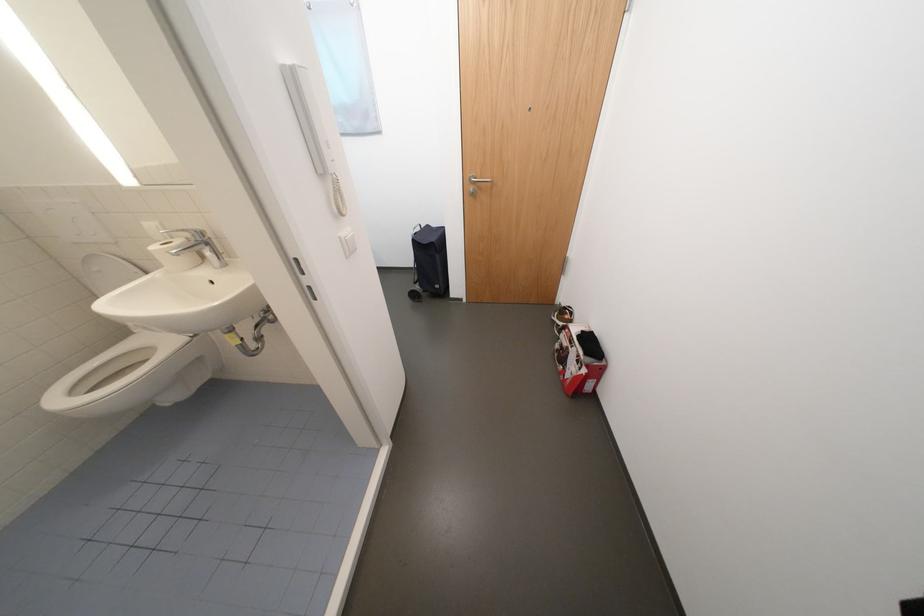
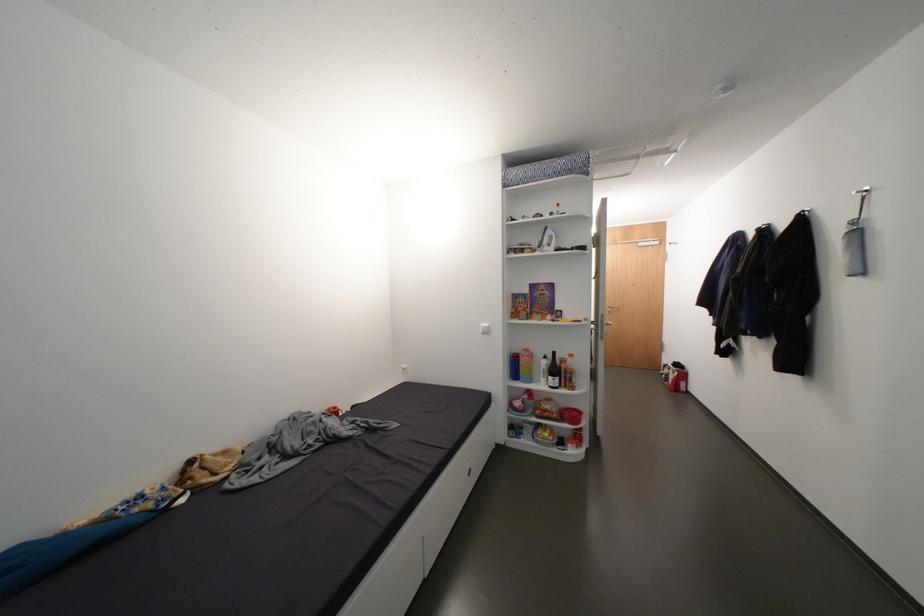
Locate, in the second image, the point that corresponds to pixel 592 371 in the first image.

(684, 374)